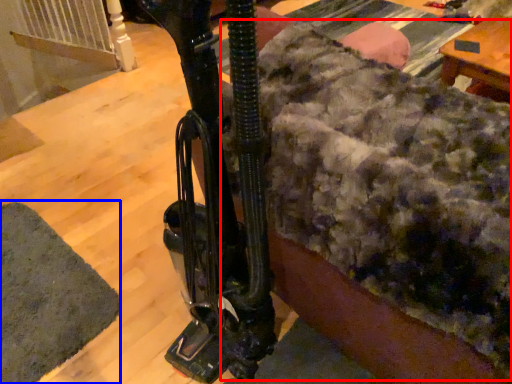
Question: Which point is further to the camera, blanket (highlighted by a red box) or mat (highlighted by a blue box)?

Choices:
 (A) blanket
 (B) mat

Answer: (B)